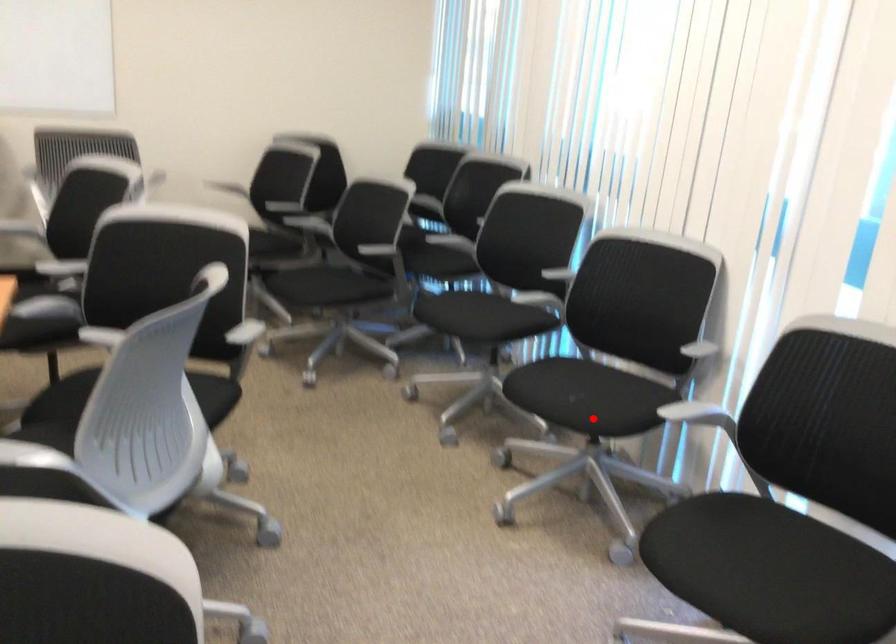
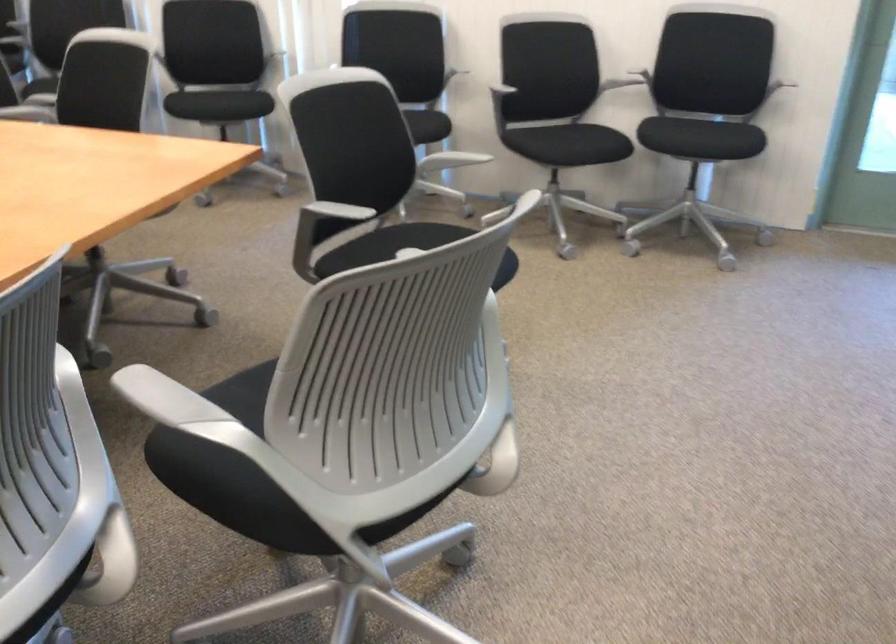
Locate, in the second image, the point that corresponds to the highlighted location in the first image.

(238, 102)